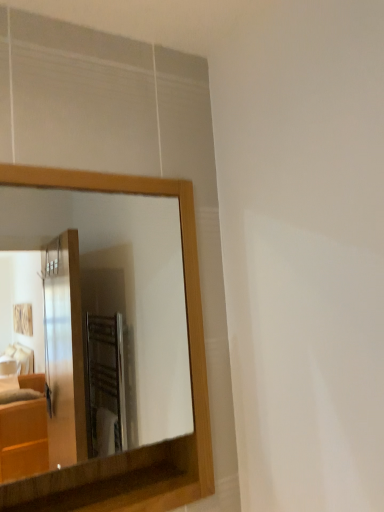
What do you see at coordinates (122, 289) in the screenshot? I see `wooden mirror at upper left` at bounding box center [122, 289].

This screenshot has width=384, height=512. I want to click on wooden mirror at upper left, so click(122, 289).

Identify the location of wooden mirror at upper left. (122, 289).